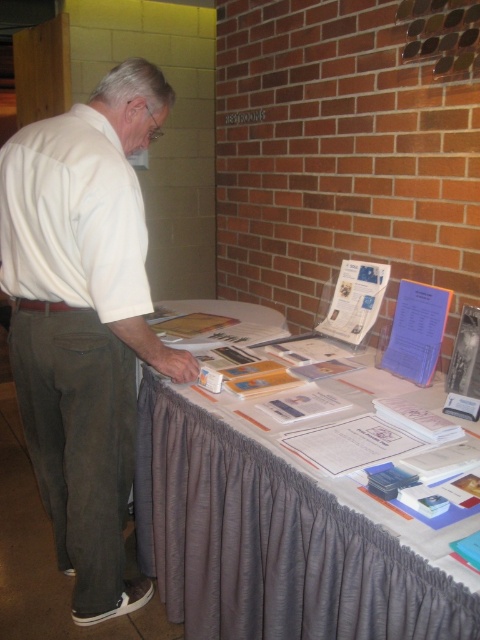
Is white cotton shirt at left wider than white matte shirt at left?

Yes.

Between white cotton shirt at left and white matte shirt at left, which one is positioned higher?

white matte shirt at left

The image size is (480, 640). Identify the location of white cotton shirt at left. [x=84, y=320].

What do you see at coordinates (286, 525) in the screenshot?
I see `gray fabric tablecloth at lower center` at bounding box center [286, 525].

Is gray fabric tablecloth at lower center bigger than white cotton shirt at left?

Yes, gray fabric tablecloth at lower center is bigger than white cotton shirt at left.

This screenshot has width=480, height=640. I want to click on gray fabric tablecloth at lower center, so click(286, 525).

What are the coordinates of `gray fabric tablecloth at lower center` in the screenshot? It's located at (286, 525).

Which is in front, point (290, 428) or point (46, 176)?

Point (290, 428) is more forward.

Locate an element on the screen. Image resolution: width=480 pixels, height=640 pixels. gray fabric tablecloth at lower center is located at coordinates (286, 525).